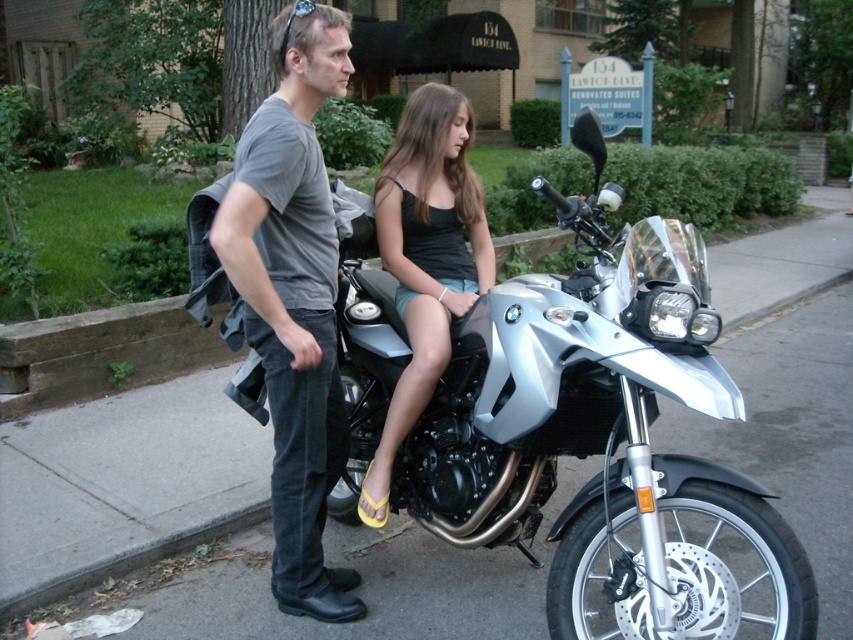
Question: Which is nearer to the gray cotton t-shirt at center?

Choices:
 (A) silver metallic motorcycle at center
 (B) black fabric tank top at center

Answer: (B)

Question: In this image, where is silver metallic motorcycle at center located relative to gray cotton t-shirt at center?

Choices:
 (A) left
 (B) right

Answer: (B)

Question: Does silver metallic motorcycle at center have a greater width compared to black fabric tank top at center?

Choices:
 (A) no
 (B) yes

Answer: (B)

Question: Which point is closer to the camera taking this photo?

Choices:
 (A) 648,497
 (B) 474,193

Answer: (A)

Question: Does gray cotton t-shirt at center lie behind black fabric tank top at center?

Choices:
 (A) yes
 (B) no

Answer: (B)

Question: Among these objects, which one is nearest to the camera?

Choices:
 (A) silver metallic motorcycle at center
 (B) gray cotton t-shirt at center
 (C) black fabric tank top at center

Answer: (A)